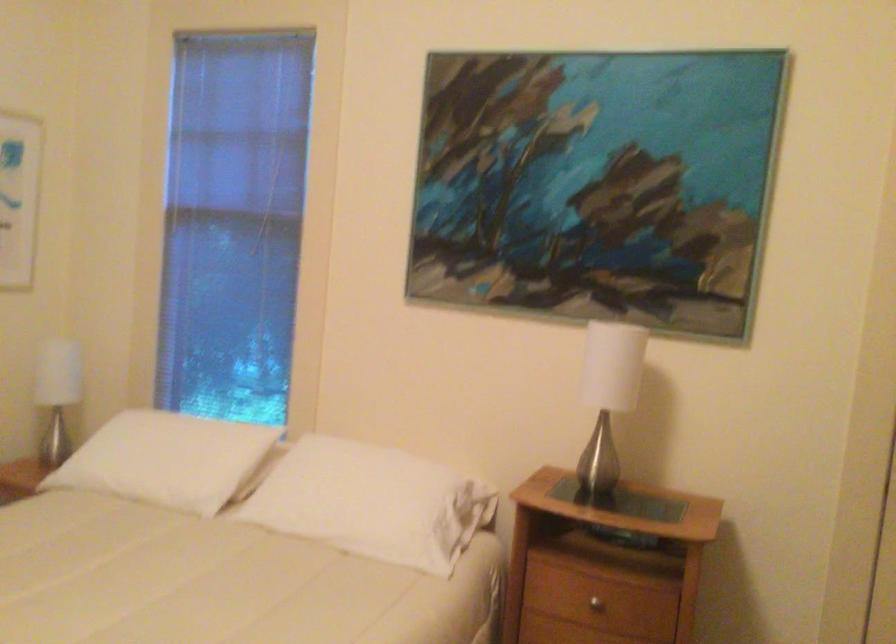
You are a GUI agent. You are given a task and a screenshot of the screen. Output one action in this format:
    pyautogui.click(x=<x>, y=<y>)
    Task: Click on the white table lamp
    This screenshot has height=644, width=896.
    Given the screenshot: What is the action you would take?
    pyautogui.click(x=56, y=393)